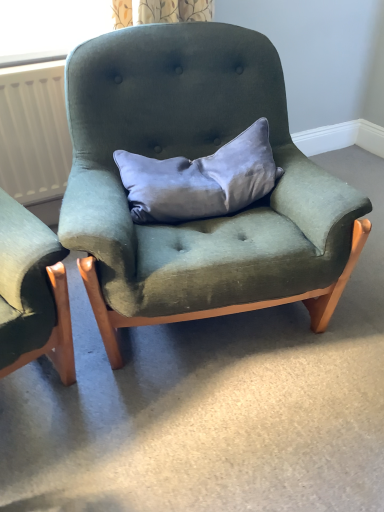
Question: From the image's perspective, is white matte radiator at left located above velvet green armchair at center?

Choices:
 (A) no
 (B) yes

Answer: (B)

Question: Does white matte radiator at left have a lesser width compared to velvet green armchair at center?

Choices:
 (A) yes
 (B) no

Answer: (A)

Question: Are white matte radiator at left and velvet green armchair at center making contact?

Choices:
 (A) yes
 (B) no

Answer: (B)

Question: Does white matte radiator at left come behind velvet green armchair at center?

Choices:
 (A) yes
 (B) no

Answer: (A)

Question: Can you confirm if white matte radiator at left is bigger than velvet green armchair at center?

Choices:
 (A) yes
 (B) no

Answer: (B)

Question: Does white matte radiator at left appear on the right side of velvet green armchair at center?

Choices:
 (A) yes
 (B) no

Answer: (B)

Question: From a real-world perspective, does velvet green armchair at center sit lower than satin gray pillow at center?

Choices:
 (A) no
 (B) yes

Answer: (B)

Question: Does velvet green armchair at center appear on the right side of satin gray pillow at center?

Choices:
 (A) no
 (B) yes

Answer: (A)

Question: Is velvet green armchair at center positioned behind satin gray pillow at center?

Choices:
 (A) yes
 (B) no

Answer: (B)

Question: Can we say velvet green armchair at center lies outside satin gray pillow at center?

Choices:
 (A) no
 (B) yes

Answer: (B)

Question: Is velvet green armchair at center bigger than satin gray pillow at center?

Choices:
 (A) yes
 (B) no

Answer: (A)

Question: From the image's perspective, is velvet green armchair at center located beneath satin gray pillow at center?

Choices:
 (A) yes
 (B) no

Answer: (A)

Question: From a real-world perspective, does velvet green armchair at center stand above white matte radiator at left?

Choices:
 (A) yes
 (B) no

Answer: (B)